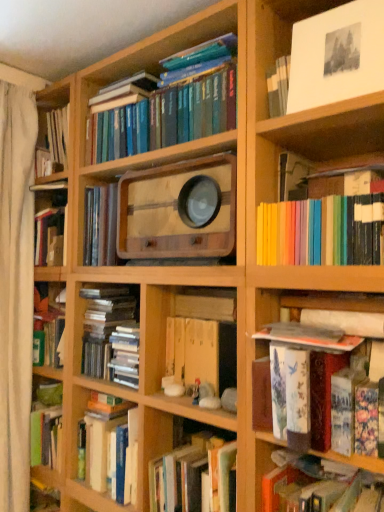
Where is `vacant space situated above white fabric curtain at left (from a real-world perspective)`? Image resolution: width=384 pixels, height=512 pixels. vacant space situated above white fabric curtain at left (from a real-world perspective) is located at coordinates pos(19,64).